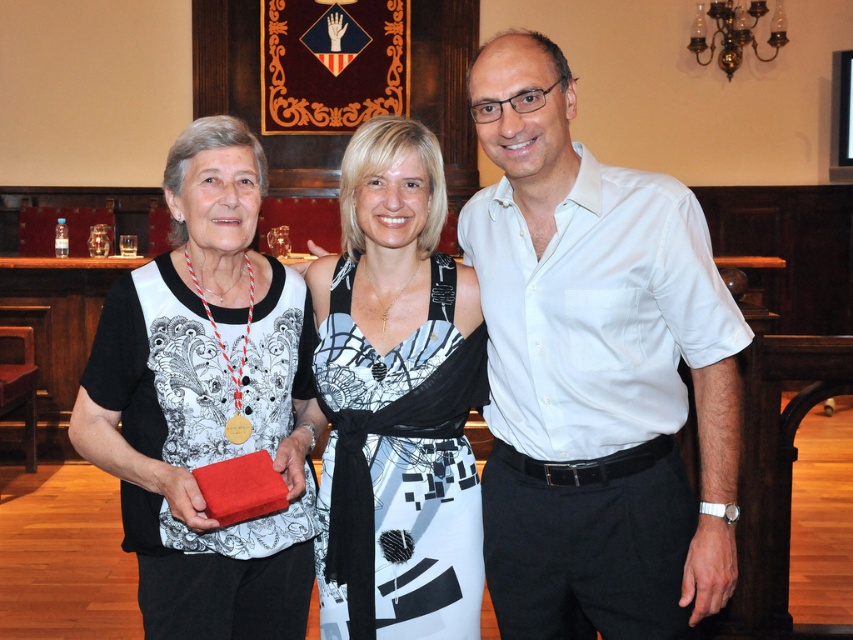
Question: Does white cotton shirt at center appear under matte black dress at center?

Choices:
 (A) no
 (B) yes

Answer: (A)

Question: Which of the following is the farthest from the observer?

Choices:
 (A) (676, 285)
 (B) (254, 232)

Answer: (B)

Question: Is matte black dress at center bigger than printed fabric dress at center?

Choices:
 (A) yes
 (B) no

Answer: (A)

Question: Does white cotton shirt at center appear over matte black dress at center?

Choices:
 (A) no
 (B) yes

Answer: (B)

Question: Which of the following is the farthest from the observer?

Choices:
 (A) white cotton shirt at center
 (B) matte black dress at center
 (C) printed fabric dress at center

Answer: (C)

Question: Which object is positioned farthest from the white cotton shirt at center?

Choices:
 (A) matte black dress at center
 (B) printed fabric dress at center

Answer: (A)